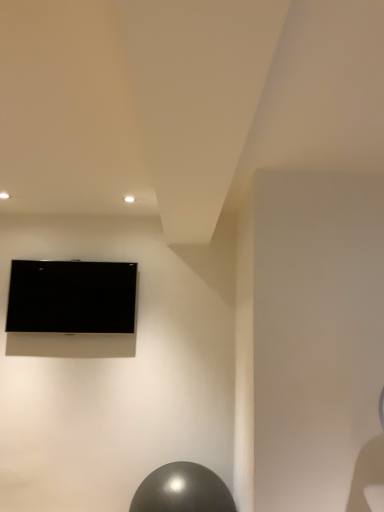
Question: Is black glossy tv at upper left surrounded by glossy metallic ball at lower center?

Choices:
 (A) no
 (B) yes

Answer: (A)

Question: Could you tell me if glossy metallic ball at lower center is facing black glossy tv at upper left?

Choices:
 (A) no
 (B) yes

Answer: (A)

Question: Does glossy metallic ball at lower center appear on the right side of black glossy tv at upper left?

Choices:
 (A) no
 (B) yes

Answer: (B)

Question: Is the position of glossy metallic ball at lower center more distant than that of black glossy tv at upper left?

Choices:
 (A) no
 (B) yes

Answer: (A)

Question: Are glossy metallic ball at lower center and black glossy tv at upper left beside each other?

Choices:
 (A) yes
 (B) no

Answer: (B)

Question: Is glossy metallic ball at lower center smaller than black glossy tv at upper left?

Choices:
 (A) no
 (B) yes

Answer: (A)

Question: Is black glossy tv at upper left surrounding glossy metallic ball at lower center?

Choices:
 (A) no
 (B) yes

Answer: (A)

Question: Is black glossy tv at upper left positioned beyond the bounds of glossy metallic ball at lower center?

Choices:
 (A) no
 (B) yes

Answer: (B)

Question: Does black glossy tv at upper left have a lesser width compared to glossy metallic ball at lower center?

Choices:
 (A) yes
 (B) no

Answer: (A)

Question: From a real-world perspective, is black glossy tv at upper left below glossy metallic ball at lower center?

Choices:
 (A) yes
 (B) no

Answer: (B)

Question: From a real-world perspective, is black glossy tv at upper left physically above glossy metallic ball at lower center?

Choices:
 (A) no
 (B) yes

Answer: (B)

Question: Is black glossy tv at upper left smaller than glossy metallic ball at lower center?

Choices:
 (A) yes
 (B) no

Answer: (A)

Question: From a real-world perspective, is glossy metallic ball at lower center positioned above or below black glossy tv at upper left?

Choices:
 (A) below
 (B) above

Answer: (A)